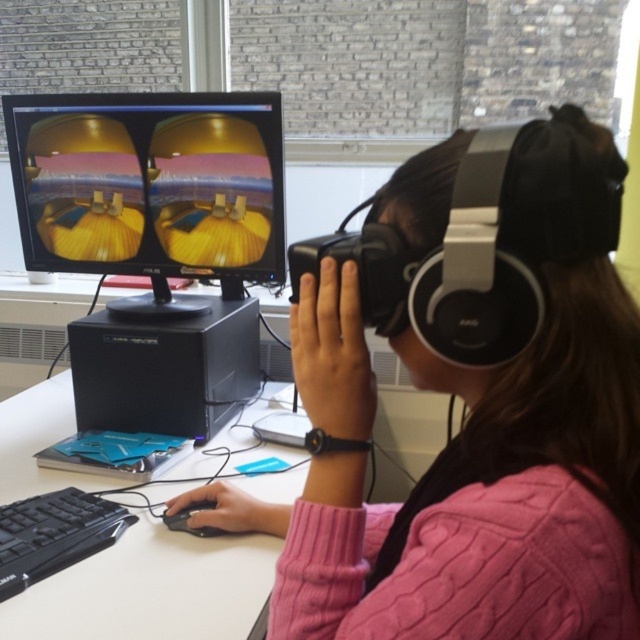
Question: Does pink cable-knit sweater at center have a larger size compared to black matte mouse at lower center?

Choices:
 (A) yes
 (B) no

Answer: (A)

Question: Does pink cable-knit sweater at center appear under black plastic computer at center?

Choices:
 (A) no
 (B) yes

Answer: (B)

Question: Which point appears farthest from the camera in this image?

Choices:
 (A) (x=128, y=390)
 (B) (x=593, y=531)
 (C) (x=177, y=525)

Answer: (A)

Question: Which point is farther to the camera?

Choices:
 (A) matte black monitor at center
 (B) black plastic keyboard at lower left

Answer: (A)

Question: Is pink cable-knit sweater at center further to camera compared to black matte mouse at lower center?

Choices:
 (A) no
 (B) yes

Answer: (A)

Question: Which point is farther to the camera?

Choices:
 (A) black plastic keyboard at lower left
 (B) black matte mouse at lower center
 (C) pink cable-knit sweater at center

Answer: (B)